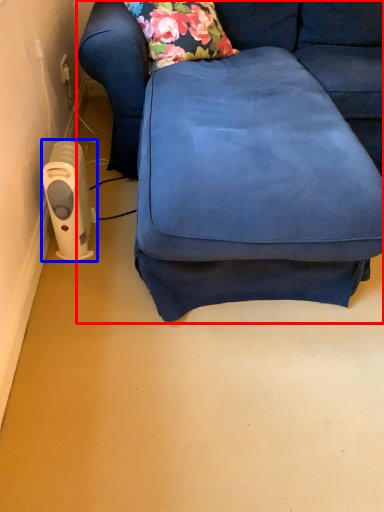
Question: Among these objects, which one is farthest to the camera, studio couch (highlighted by a red box) or appliance (highlighted by a blue box)?

Choices:
 (A) studio couch
 (B) appliance

Answer: (B)